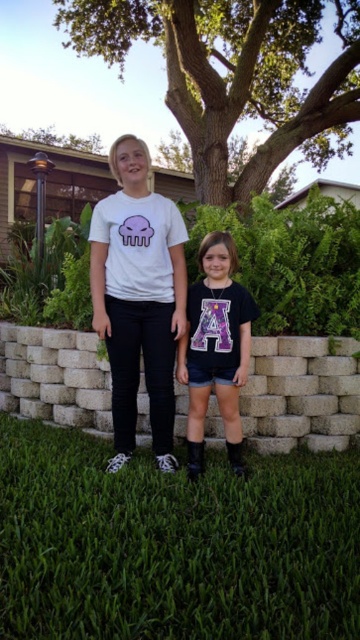
Based on the scene description, what is the 2D coordinate of the green grass at center?

The 2D coordinate of the green grass at center is at point (173,545).

You are standing at point (173, 545) in the image. What is under your feet?

The green grass at center is located at point (173, 545), so the ground under your feet is green grass at center.